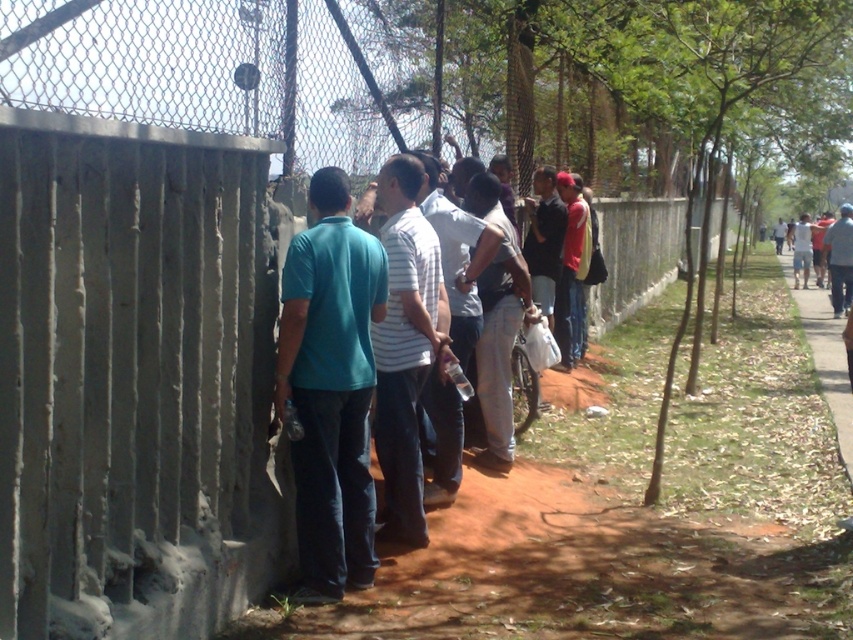
Does teal matte shirt at center have a larger size compared to matte red shirt at center?

No, teal matte shirt at center is not bigger than matte red shirt at center.

Between point (366, 460) and point (578, 214), which one is positioned in front?

Point (366, 460) is more forward.

The image size is (853, 640). Describe the element at coordinates (329, 387) in the screenshot. I see `teal matte shirt at center` at that location.

The image size is (853, 640). Find the location of `teal matte shirt at center`. teal matte shirt at center is located at coordinates (329, 387).

Can you confirm if white striped shirt at center is smaller than matte red shirt at center?

Yes, white striped shirt at center is smaller than matte red shirt at center.

Who is positioned more to the right, white striped shirt at center or matte red shirt at center?

matte red shirt at center is more to the right.

This screenshot has width=853, height=640. I want to click on white striped shirt at center, so click(405, 344).

Can you confirm if teal matte shirt at center is positioned below white striped shirt at center?

Yes, teal matte shirt at center is below white striped shirt at center.

Does teal matte shirt at center have a lesser width compared to white striped shirt at center?

No, teal matte shirt at center is not thinner than white striped shirt at center.

Is point (322, 403) positioned after point (376, 449)?

No, it is in front of (376, 449).

Identify the location of teal matte shirt at center. This screenshot has height=640, width=853. (329, 387).